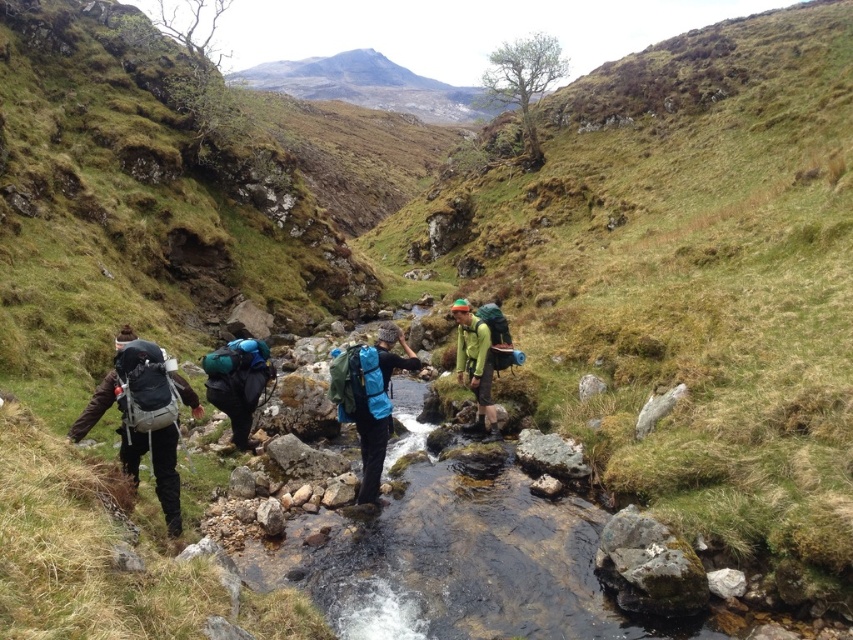
You are a hiker planning to cross the rocky stream. You have a choice between the matte black backpack at left and the matte blue backpack at center. Which backpack is narrower and thus easier to carry through the narrow spaces between the rocks?

The matte black backpack at left is narrower than the matte blue backpack at center, making it easier to navigate through narrow spaces between the rocks.

The hikers are trying to cross the stream safely. They need to know if the blue fabric backpack at center is positioned over the rocky stream. Based on the coordinates provided, can you confirm if the point at (370, 397) falls on the blue fabric backpack at center?

Yes, the point at (370, 397) is on the blue fabric backpack at center, so the backpack is positioned over the rocky stream.